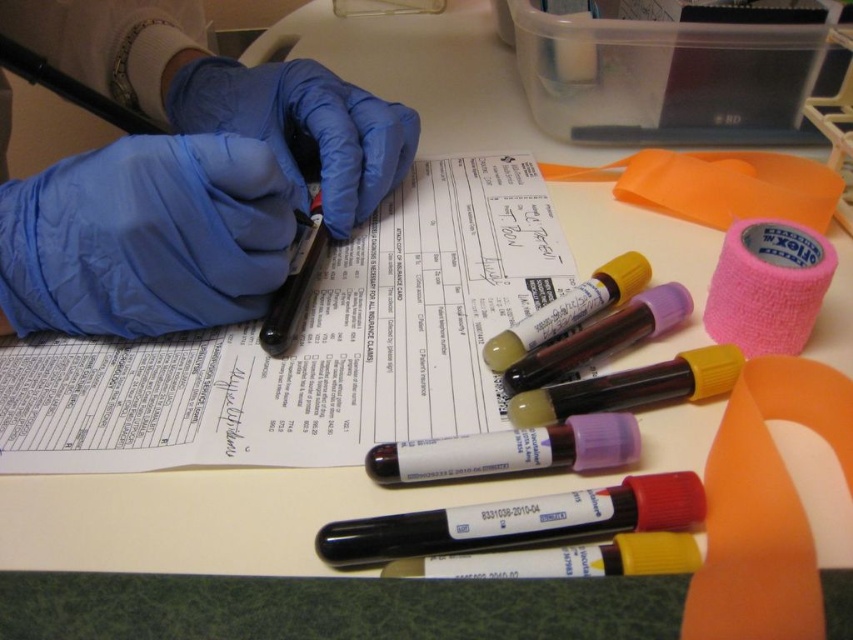
Is point (282, 177) more distant than point (341, 148)?

No, (282, 177) is in front of (341, 148).

Between point (71, 257) and point (258, 134), which one is positioned behind?

Point (258, 134)

Identify the location of blue rubber glove at upper left. (144, 237).

Where is `blue rubber glove at upper left`? blue rubber glove at upper left is located at coordinates (144, 237).

Is white paper at center taller than blue rubber glove at upper left?

Yes.

Does white paper at center have a greater width compared to blue rubber glove at upper left?

Yes, white paper at center is wider than blue rubber glove at upper left.

Who is more distant from viewer, (x=456, y=417) or (x=28, y=244)?

The point (x=28, y=244) is behind.

Locate an element on the screen. white paper at center is located at coordinates (312, 346).

The height and width of the screenshot is (640, 853). Find the location of `white paper at center`. white paper at center is located at coordinates (312, 346).

Can you confirm if white paper at center is bigger than blue latex glove at upper left?

No, white paper at center is not bigger than blue latex glove at upper left.

What do you see at coordinates (312, 346) in the screenshot? I see `white paper at center` at bounding box center [312, 346].

At what (x,y) coordinates should I click in order to perform the action: click on white paper at center. Please return your answer as a coordinate pair (x, y). Looking at the image, I should click on (312, 346).